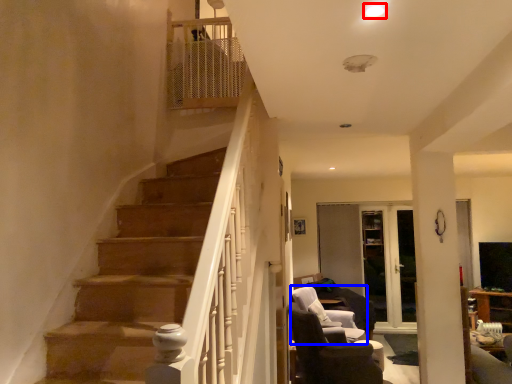
Question: Among these objects, which one is nearest to the camera, light (highlighted by a red box) or chair (highlighted by a blue box)?

Choices:
 (A) light
 (B) chair

Answer: (A)